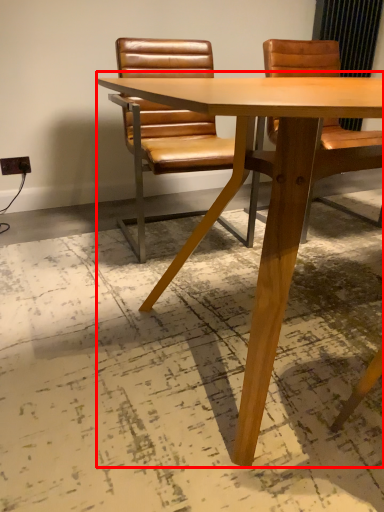
Question: From the image's perspective, what is the correct spatial relationship of table (annotated by the red box) in relation to chair?

Choices:
 (A) below
 (B) above

Answer: (A)